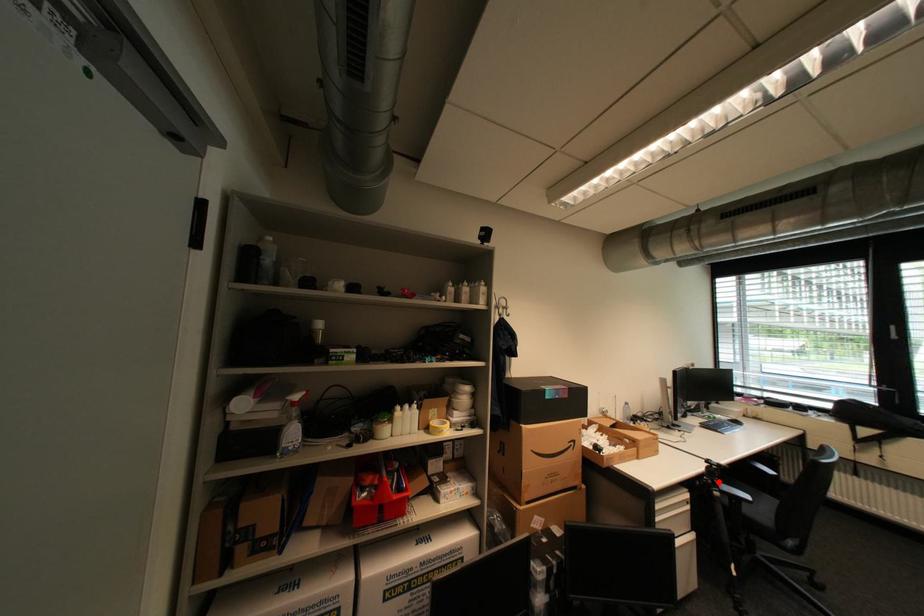
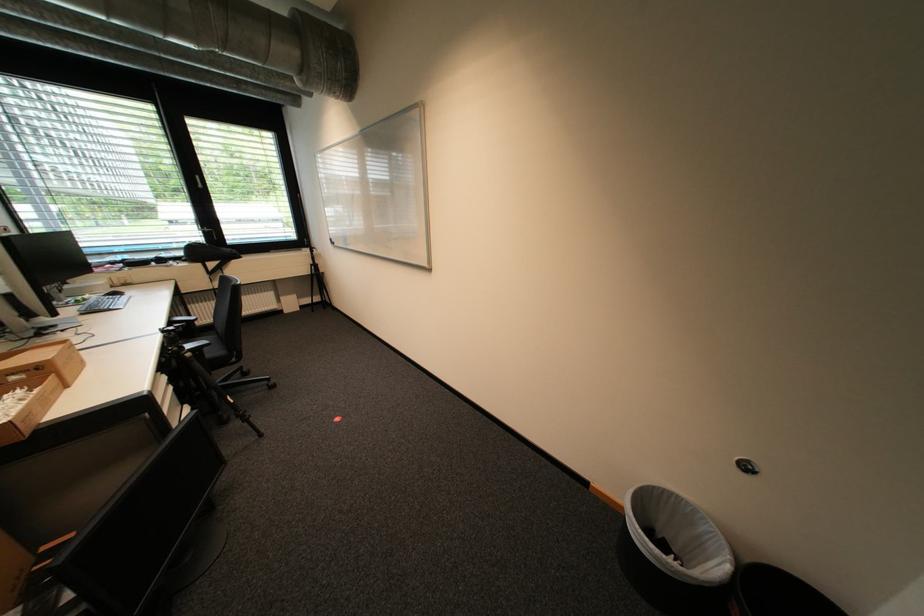
The point at the highlighted location is marked in the first image. Where is the corresponding point in the second image?

(185, 349)